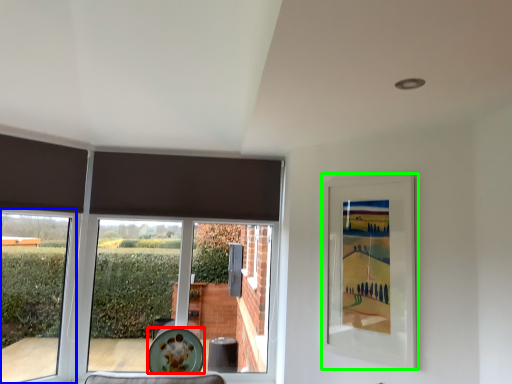
Question: Based on their relative distances, which object is farther from plate (highlighted by a red box)? Choose from window (highlighted by a blue box) and picture frame (highlighted by a green box).

Choices:
 (A) window
 (B) picture frame

Answer: (B)